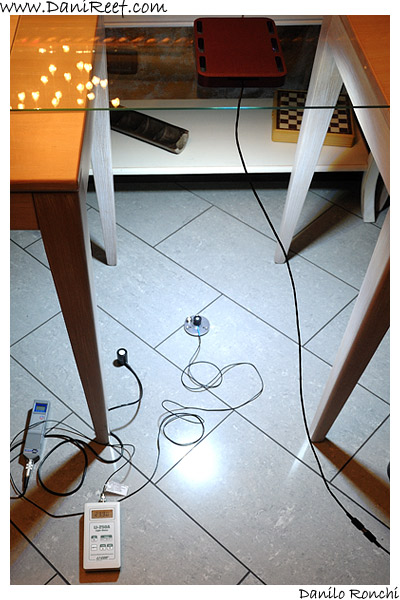
I want to click on glass top, so click(201, 100).